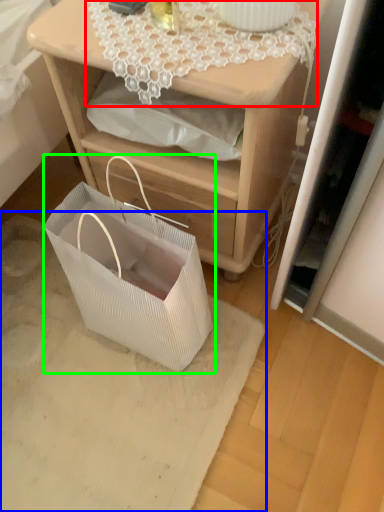
Question: Based on their relative distances, which object is farther from lace (highlighted by a red box)? Choose from mat (highlighted by a blue box) and gift basket (highlighted by a green box).

Choices:
 (A) mat
 (B) gift basket

Answer: (A)